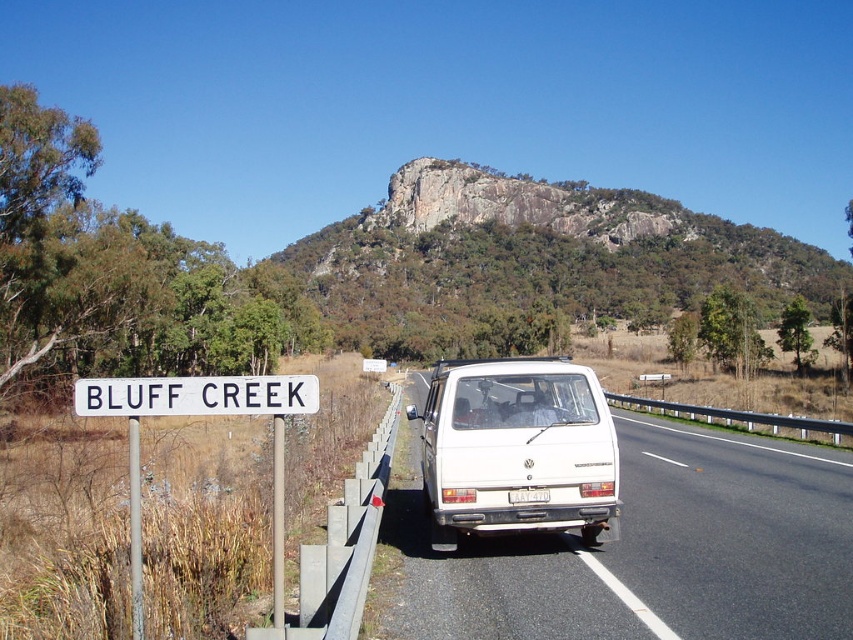
Who is positioned more to the right, white plastic van at center or rugged rock formation at center?

From the viewer's perspective, rugged rock formation at center appears more on the right side.

Is white plastic van at center positioned in front of rugged rock formation at center?

Yes.

This screenshot has width=853, height=640. What do you see at coordinates (648, 550) in the screenshot?
I see `white plastic van at center` at bounding box center [648, 550].

Locate an element on the screen. Image resolution: width=853 pixels, height=640 pixels. white plastic van at center is located at coordinates pos(648,550).

Is point (424, 541) closer to viewer compared to point (495, 481)?

No, it is not.

Is the position of white plastic van at center more distant than that of white matte van at center?

No, it is not.

The width and height of the screenshot is (853, 640). Describe the element at coordinates (648, 550) in the screenshot. I see `white plastic van at center` at that location.

This screenshot has width=853, height=640. I want to click on white plastic van at center, so click(648, 550).

Is point (608, 307) less distant than point (317, 388)?

No, it is behind (317, 388).

Which is in front, point (849, 266) or point (289, 406)?

Point (289, 406) is more forward.

This screenshot has width=853, height=640. I want to click on rugged rock formation at center, so click(540, 252).